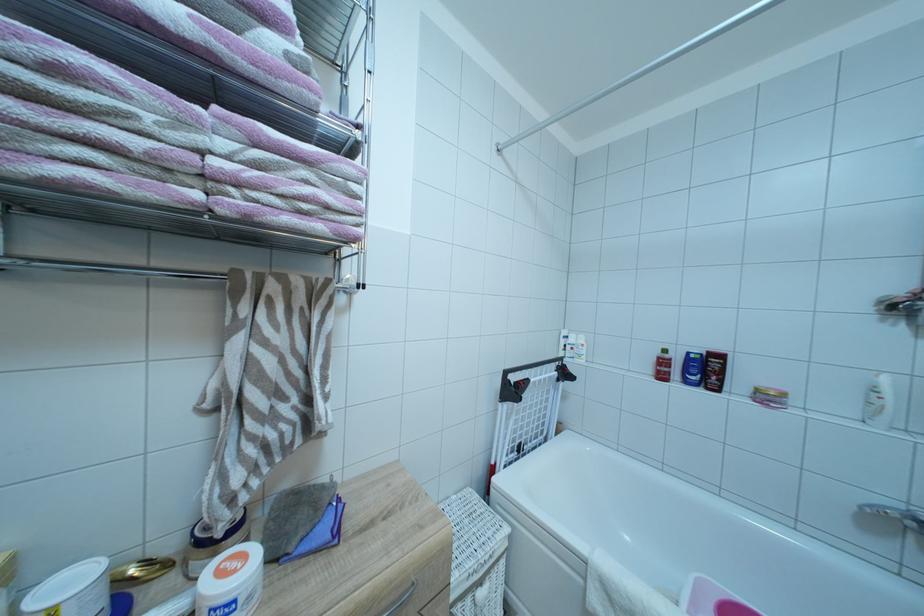
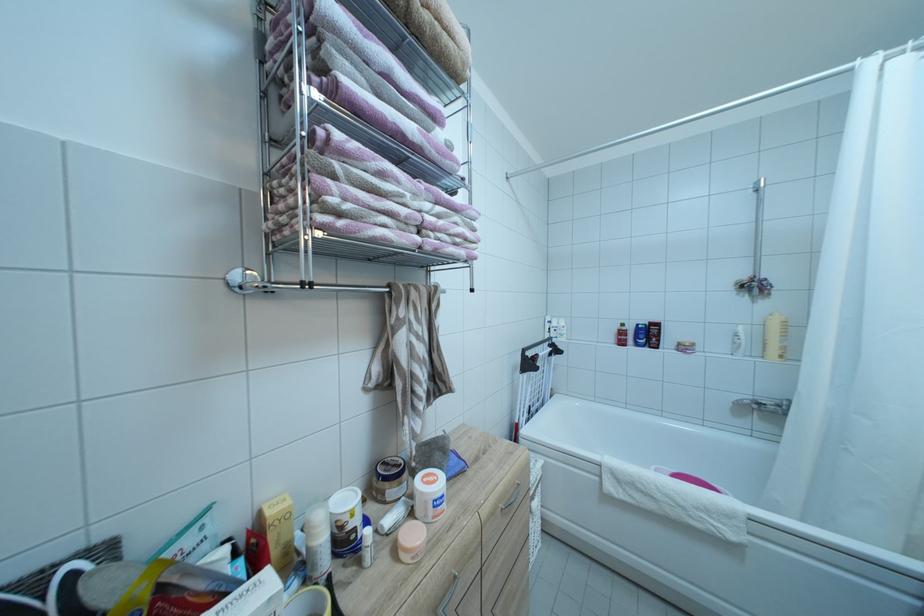
In the second image, find the point that corresponds to (x=691, y=377) in the first image.

(642, 342)